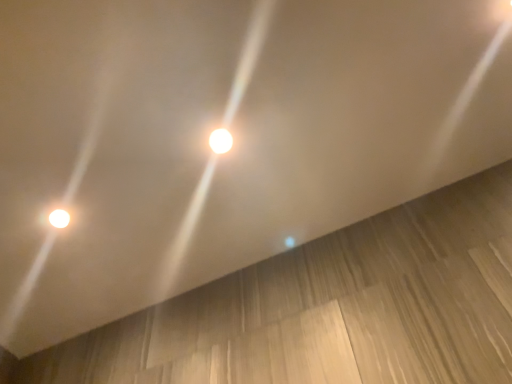
You are a GUI agent. You are given a task and a screenshot of the screen. Output one action in this format:
    pyautogui.click(x=<x>, y=<y>)
    Task: Click on the matte white lamp at lower left, arranged as the second lamp when viewed from the right
    
    Given the screenshot: What is the action you would take?
    [x=59, y=218]

Locate an element on the screen. The image size is (512, 384). matte white lamp at lower left, arranged as the second lamp when viewed from the right is located at coordinates (59, 218).

How different are the orientations of white glossy light at center, the second lamp in the bottom-to-top sequence, and matte white lamp at lower left, which appears as the 2th lamp when viewed from the front, in degrees?

There is a 2.44e-05-degree angle between the facing directions of white glossy light at center, the second lamp in the bottom-to-top sequence, and matte white lamp at lower left, which appears as the 2th lamp when viewed from the front.

Which is nearer, (228, 147) or (53, 211)?

The point (228, 147) is in front.

Consider the image. Is white glossy light at center, the second lamp in the bottom-to-top sequence, positioned far away from matte white lamp at lower left, the second lamp in the top-to-bottom sequence?

No, there isn't a large distance between white glossy light at center, the second lamp in the bottom-to-top sequence, and matte white lamp at lower left, the second lamp in the top-to-bottom sequence.

Does white glossy light at center, the 1th lamp in the top-to-bottom sequence, have a larger size compared to matte white lamp at lower left, the second lamp in the top-to-bottom sequence?

Yes, white glossy light at center, the 1th lamp in the top-to-bottom sequence, is bigger than matte white lamp at lower left, the second lamp in the top-to-bottom sequence.

Is white glossy light at center, the second lamp viewed from the back, located within matte white lamp at lower left, the second lamp in the top-to-bottom sequence?

No, white glossy light at center, the second lamp viewed from the back, is located outside of matte white lamp at lower left, the second lamp in the top-to-bottom sequence.

Between matte white lamp at lower left, arranged as the second lamp when viewed from the right, and white glossy light at center, the first lamp when ordered from front to back, which one appears on the left side from the viewer's perspective?

matte white lamp at lower left, arranged as the second lamp when viewed from the right, is more to the left.

From the image's perspective, is matte white lamp at lower left, arranged as the second lamp when viewed from the right, below white glossy light at center, the second lamp in the bottom-to-top sequence?

Correct, matte white lamp at lower left, arranged as the second lamp when viewed from the right, appears lower than white glossy light at center, the second lamp in the bottom-to-top sequence, in the image.

Is matte white lamp at lower left, the first lamp when ordered from back to front, bigger or smaller than light brown wood at lower right?

Clearly, matte white lamp at lower left, the first lamp when ordered from back to front, is smaller in size than light brown wood at lower right.

This screenshot has width=512, height=384. Find the location of `plywood in front of the matte white lamp at lower left, arranged as the second lamp when viewed from the right`. plywood in front of the matte white lamp at lower left, arranged as the second lamp when viewed from the right is located at coordinates [x=331, y=308].

Between point (69, 220) and point (143, 381), which one is positioned behind?

The point (69, 220) is behind.

Is matte white lamp at lower left, the first lamp in the bottom-to-top sequence, taller than light brown wood at lower right?

No, matte white lamp at lower left, the first lamp in the bottom-to-top sequence, is not taller than light brown wood at lower right.

Where is `lamp above the light brown wood at lower right (from the image's perspective)`? lamp above the light brown wood at lower right (from the image's perspective) is located at coordinates (220, 141).

In the image, is white glossy light at center, the first lamp when ordered from front to back, positioned in front of or behind light brown wood at lower right?

Visually, white glossy light at center, the first lamp when ordered from front to back, is located behind light brown wood at lower right.

Is white glossy light at center, arranged as the first lamp when viewed from the right, facing towards light brown wood at lower right?

Yes, white glossy light at center, arranged as the first lamp when viewed from the right, is turned towards light brown wood at lower right.

Does light brown wood at lower right turn towards matte white lamp at lower left, which appears as the 2th lamp when viewed from the front?

Yes, light brown wood at lower right is oriented towards matte white lamp at lower left, which appears as the 2th lamp when viewed from the front.

Can you confirm if light brown wood at lower right is taller than matte white lamp at lower left, the first lamp in the bottom-to-top sequence?

Yes, light brown wood at lower right is taller than matte white lamp at lower left, the first lamp in the bottom-to-top sequence.

Which object is thinner, light brown wood at lower right or matte white lamp at lower left, arranged as the second lamp when viewed from the right?

matte white lamp at lower left, arranged as the second lamp when viewed from the right.

Can you tell me how much light brown wood at lower right and matte white lamp at lower left, the second lamp in the top-to-bottom sequence, differ in facing direction?

They differ by 91 degrees in their facing directions.

Which of these two, light brown wood at lower right or white glossy light at center, which is the 2th lamp in left-to-right order, is thinner?

white glossy light at center, which is the 2th lamp in left-to-right order, is thinner.

From a real-world perspective, is light brown wood at lower right positioned above or below white glossy light at center, the second lamp viewed from the back?

Clearly, from a real-world perspective, light brown wood at lower right is above white glossy light at center, the second lamp viewed from the back.

Who is taller, light brown wood at lower right or white glossy light at center, the 1th lamp in the top-to-bottom sequence?

light brown wood at lower right.

This screenshot has width=512, height=384. Find the location of `lamp behind the white glossy light at center, the first lamp when ordered from front to back`. lamp behind the white glossy light at center, the first lamp when ordered from front to back is located at coordinates (59, 218).

The height and width of the screenshot is (384, 512). What are the coordinates of `lamp beneath the matte white lamp at lower left, arranged as the second lamp when viewed from the right (from a real-world perspective)` in the screenshot? It's located at (220, 141).

From the image, which object appears to be nearer to white glossy light at center, the 1th lamp in the top-to-bottom sequence, light brown wood at lower right or matte white lamp at lower left, which appears as the 2th lamp when viewed from the front?

Based on the image, matte white lamp at lower left, which appears as the 2th lamp when viewed from the front, appears to be nearer to white glossy light at center, the 1th lamp in the top-to-bottom sequence.

Based on their spatial positions, is matte white lamp at lower left, arranged as the second lamp when viewed from the right, or light brown wood at lower right closer to white glossy light at center, the 1th lamp in the top-to-bottom sequence?

matte white lamp at lower left, arranged as the second lamp when viewed from the right, lies closer to white glossy light at center, the 1th lamp in the top-to-bottom sequence, than the other object.

When comparing their distances from matte white lamp at lower left, the first lamp in the bottom-to-top sequence, does white glossy light at center, arranged as the first lamp when viewed from the right, or light brown wood at lower right seem closer?

white glossy light at center, arranged as the first lamp when viewed from the right.

Which object lies nearer to the anchor point matte white lamp at lower left, the first lamp when ordered from back to front, light brown wood at lower right or white glossy light at center, arranged as the first lamp when viewed from the right?

The object closer to matte white lamp at lower left, the first lamp when ordered from back to front, is white glossy light at center, arranged as the first lamp when viewed from the right.

When comparing their distances from light brown wood at lower right, does white glossy light at center, the 1th lamp in the top-to-bottom sequence, or matte white lamp at lower left, the second lamp in the top-to-bottom sequence, seem further?

matte white lamp at lower left, the second lamp in the top-to-bottom sequence, is positioned further to the anchor light brown wood at lower right.

From the picture: Considering their positions, is matte white lamp at lower left, the first lamp in the bottom-to-top sequence, positioned further to light brown wood at lower right than white glossy light at center, the first lamp when ordered from front to back?

matte white lamp at lower left, the first lamp in the bottom-to-top sequence, is further to light brown wood at lower right.

Where is `lamp positioned between light brown wood at lower right and matte white lamp at lower left, which is the 1th lamp in left-to-right order, from near to far`? This screenshot has width=512, height=384. lamp positioned between light brown wood at lower right and matte white lamp at lower left, which is the 1th lamp in left-to-right order, from near to far is located at coordinates (220, 141).